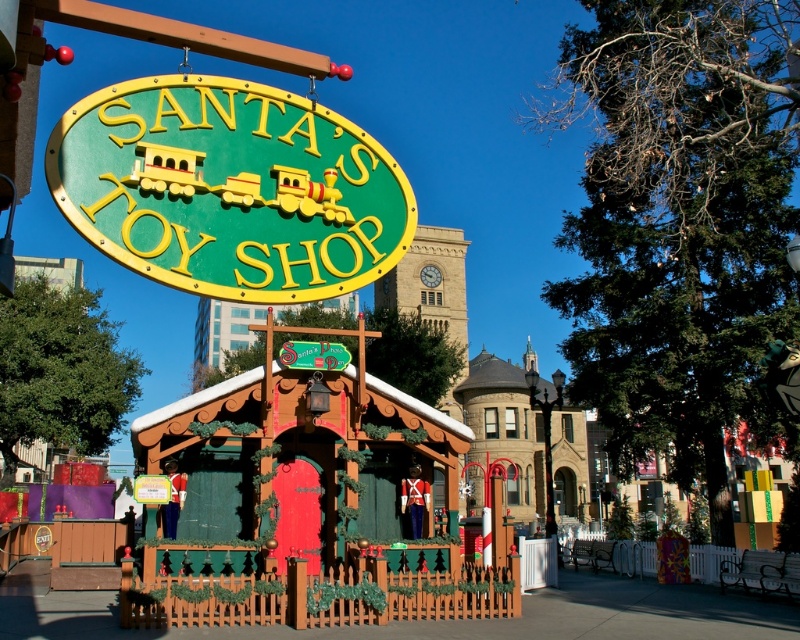
Question: Among these objects, which one is farthest from the camera?

Choices:
 (A) green matte sign at upper center
 (B) wooden cabin at center

Answer: (B)

Question: Which of the following is the farthest from the observer?

Choices:
 (A) green matte sign at upper center
 (B) wooden cabin at center
 (C) green plastic sign at center

Answer: (C)

Question: Among these points, which one is nearest to the camera?

Choices:
 (A) (220, 390)
 (B) (300, 182)

Answer: (B)

Question: Observing the image, what is the correct spatial positioning of wooden cabin at center in reference to green plastic sign at center?

Choices:
 (A) left
 (B) right

Answer: (B)

Question: Does green matte sign at upper center appear over green plastic sign at center?

Choices:
 (A) no
 (B) yes

Answer: (B)

Question: Does wooden cabin at center have a smaller size compared to green matte sign at upper center?

Choices:
 (A) no
 (B) yes

Answer: (A)